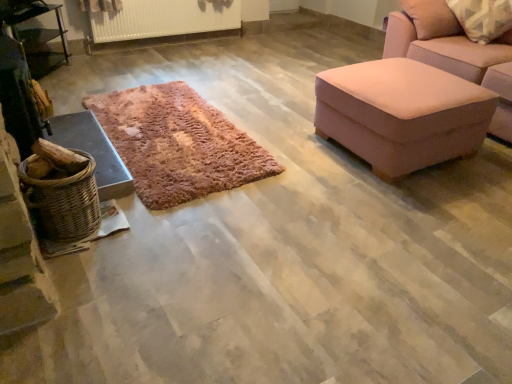
Question: From the image's perspective, is woven wood basket at left beneath woven brown basket at left?

Choices:
 (A) no
 (B) yes

Answer: (A)

Question: Is woven wood basket at left beside woven brown basket at left?

Choices:
 (A) yes
 (B) no

Answer: (B)

Question: Is woven wood basket at left completely or partially outside of woven brown basket at left?

Choices:
 (A) yes
 (B) no

Answer: (A)

Question: Is woven wood basket at left positioned in front of woven brown basket at left?

Choices:
 (A) yes
 (B) no

Answer: (B)

Question: Is woven wood basket at left behind woven brown basket at left?

Choices:
 (A) no
 (B) yes

Answer: (B)

Question: From a real-world perspective, is woven wood basket at left physically above woven brown basket at left?

Choices:
 (A) no
 (B) yes

Answer: (A)

Question: Does metallic silver table at left have a smaller size compared to woven wood basket at left?

Choices:
 (A) no
 (B) yes

Answer: (A)

Question: Is metallic silver table at left to the right of woven wood basket at left from the viewer's perspective?

Choices:
 (A) yes
 (B) no

Answer: (B)

Question: Is metallic silver table at left thinner than woven wood basket at left?

Choices:
 (A) no
 (B) yes

Answer: (B)

Question: From a real-world perspective, is metallic silver table at left below woven wood basket at left?

Choices:
 (A) no
 (B) yes

Answer: (A)

Question: Considering the relative sizes of metallic silver table at left and woven wood basket at left in the image provided, is metallic silver table at left shorter than woven wood basket at left?

Choices:
 (A) yes
 (B) no

Answer: (B)

Question: Can you confirm if metallic silver table at left is wider than woven wood basket at left?

Choices:
 (A) no
 (B) yes

Answer: (A)

Question: Can you confirm if metallic silver table at left is bigger than woven brown basket at left?

Choices:
 (A) no
 (B) yes

Answer: (B)